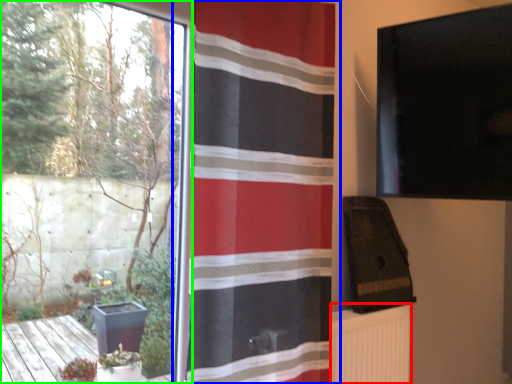
Question: Considering the real-world distances, which object is farthest from radiator (highlighted by a red box)? curtain (highlighted by a blue box) or window (highlighted by a green box)?

Choices:
 (A) curtain
 (B) window

Answer: (B)